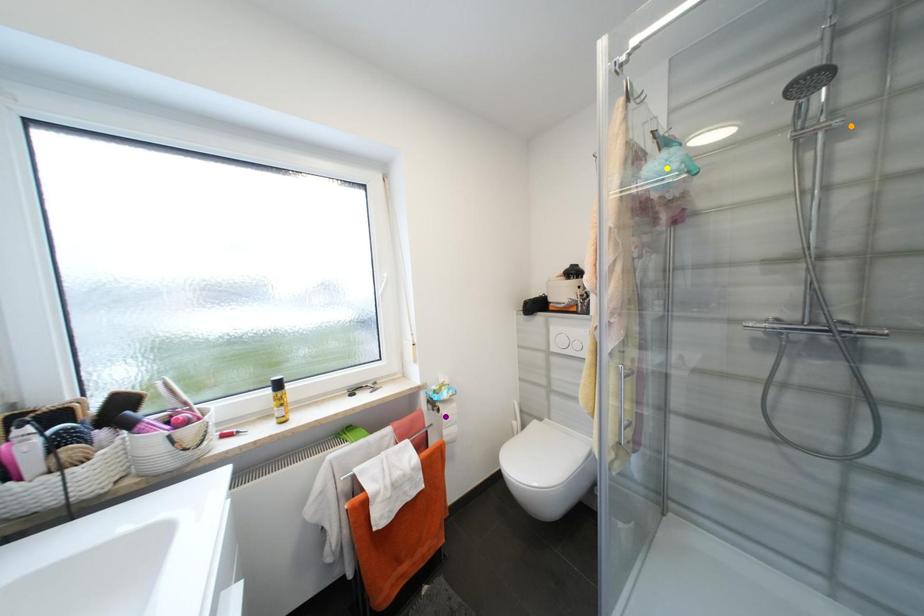
Order these from nearest to farthest:
- purple point
- yellow point
- orange point

purple point → yellow point → orange point